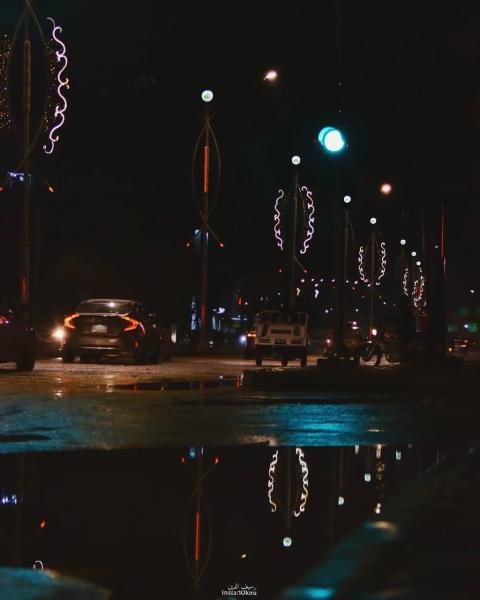
Identify the location of decoration. The width and height of the screenshot is (480, 600). coord(310,229).